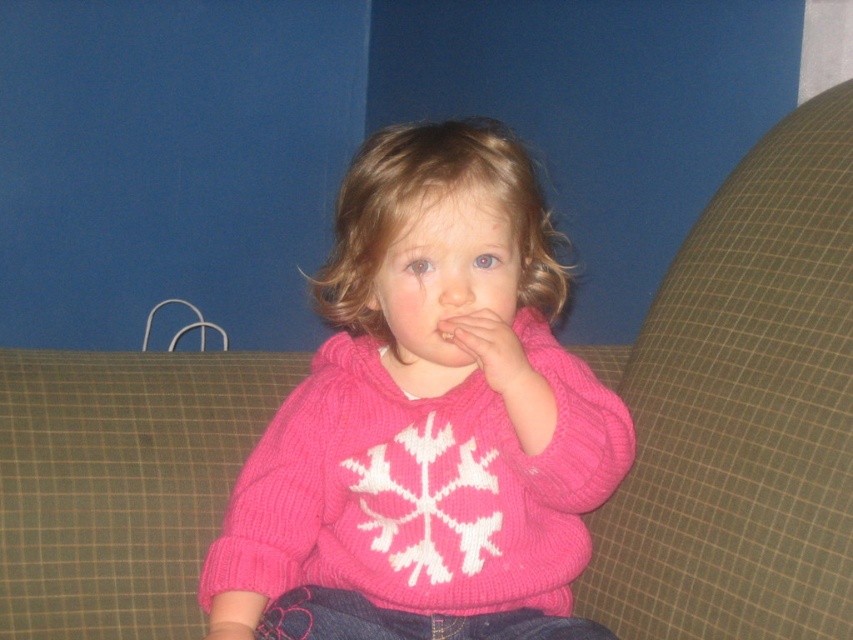
Question: Estimate the real-world distances between objects in this image. Which object is closer to the matte pink sweater at center?

Choices:
 (A) pink knitted mouth at center
 (B) pink knitted sweater at center

Answer: (A)

Question: Which point is farther to the camera?

Choices:
 (A) (535, 376)
 (B) (471, 333)
 (C) (573, 476)

Answer: (C)

Question: Observing the image, what is the correct spatial positioning of pink knitted sweater at center in reference to matte pink sweater at center?

Choices:
 (A) left
 (B) right

Answer: (A)

Question: Which of the following is the farthest from the observer?

Choices:
 (A) matte pink sweater at center
 (B) pink knitted mouth at center

Answer: (B)

Question: Can you confirm if pink knitted sweater at center is positioned above pink knitted mouth at center?

Choices:
 (A) yes
 (B) no

Answer: (B)

Question: Does matte pink sweater at center appear over pink knitted mouth at center?

Choices:
 (A) no
 (B) yes

Answer: (A)